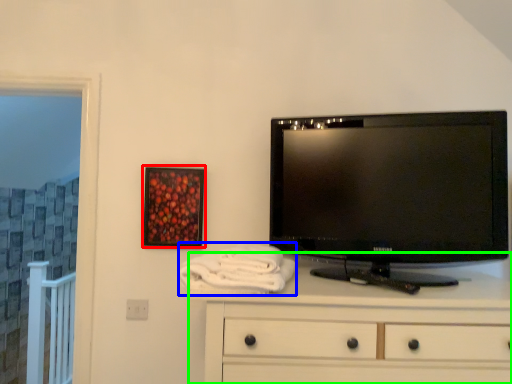
Question: Which object is positioned closest to picture frame (highlighted by a red box)? Select from bath towel (highlighted by a blue box) and chest of drawers (highlighted by a green box).

Choices:
 (A) bath towel
 (B) chest of drawers

Answer: (A)